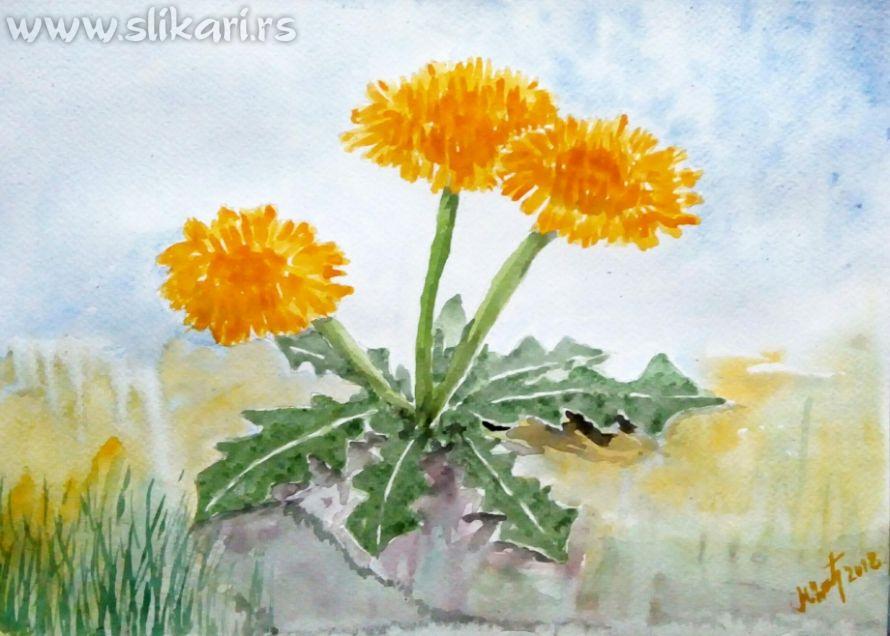
Where is `plant`? plant is located at coordinates (430, 410).